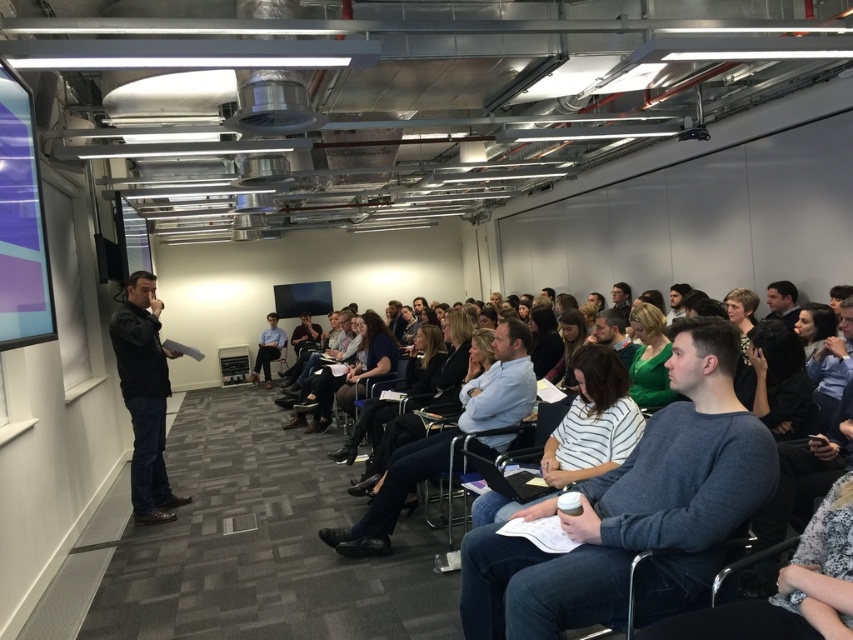
You are an event organizer who needs to set up a new projector. The projector requires a minimum distance of 10 feet from the screen to function properly. Given the current setup, can the projector be placed behind the black fabric at center and still project onto the matte purple projection screen at left?

The matte purple projection screen at left is 11.22 feet away from the black fabric at center. Since the projector needs at least 10 feet of distance, placing it behind the black fabric at center would provide sufficient distance for proper projection.

You are attending a presentation in the conference room. The presenter is standing near the matte purple projection screen at left. If you want to move to the opposite side of the screen, which direction should you head towards?

The matte purple projection screen at left is located at point 0.350 on the x and 0.026 on the y coordinates. To move to the opposite side, you should head towards the right side of the room since the screen is on the left.